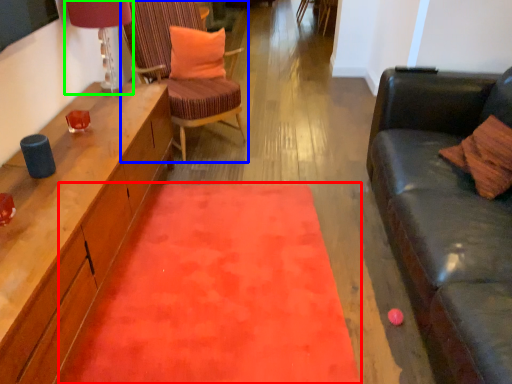
Question: Based on their relative distances, which object is nearer to mat (highlighted by a red box)? Choose from chair (highlighted by a blue box) and lamp (highlighted by a green box).

Choices:
 (A) chair
 (B) lamp

Answer: (A)